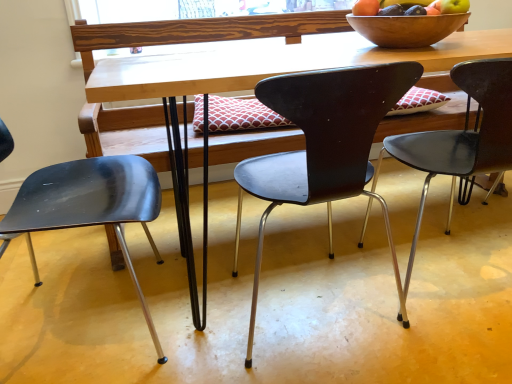
This screenshot has width=512, height=384. Identify the location of free space in front of matte black chair at center, arranged as the first chair when viewed from the right. (449, 342).